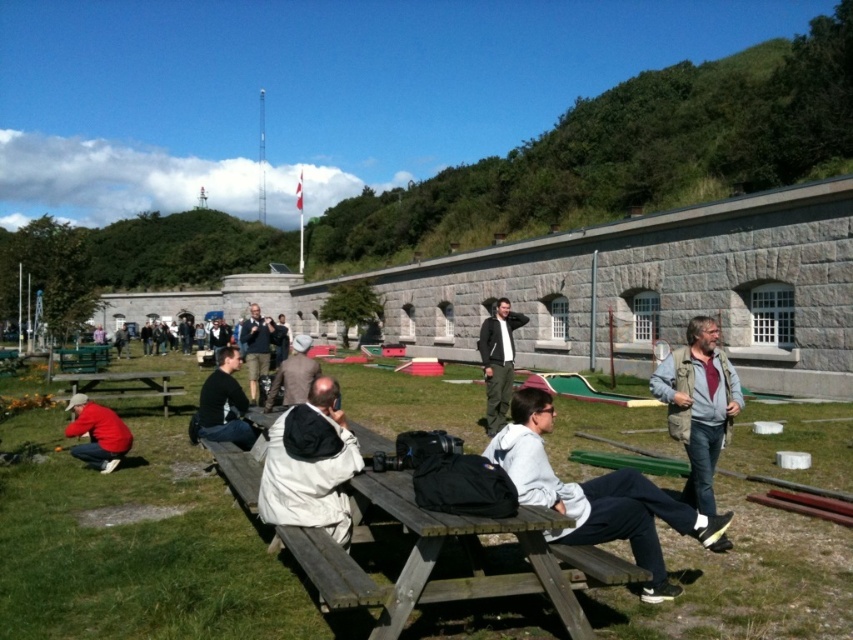
Consider the image. Does dark green jacket at center lie in front of matte red jacket at lower left?

No, dark green jacket at center is behind matte red jacket at lower left.

Is dark green jacket at center wider than matte red jacket at lower left?

Yes, dark green jacket at center is wider than matte red jacket at lower left.

What do you see at coordinates (498, 362) in the screenshot? The height and width of the screenshot is (640, 853). I see `dark green jacket at center` at bounding box center [498, 362].

The image size is (853, 640). Find the location of `dark green jacket at center`. dark green jacket at center is located at coordinates (498, 362).

Does wooden picnic table at lower left have a greater width compared to dark blue jacket at center?

No, wooden picnic table at lower left is not wider than dark blue jacket at center.

Locate an element on the screen. wooden picnic table at lower left is located at coordinates (123, 385).

Who is more distant from viewer, (262, 516) or (80, 385)?

The point (80, 385) is more distant.

Does point (258, 493) lie in front of point (151, 376)?

That is True.

Does point (294, 518) come farther from viewer compared to point (164, 412)?

No.

Where is `beige fabric jacket at center`? The width and height of the screenshot is (853, 640). beige fabric jacket at center is located at coordinates (310, 465).